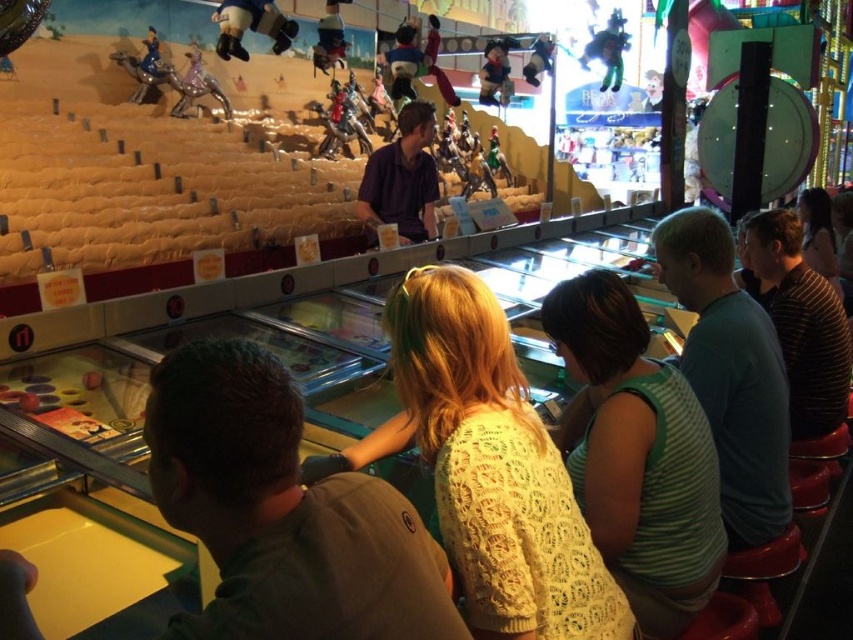
Does green striped tank top at center appear over green striped shirt at right?

Indeed, green striped tank top at center is positioned over green striped shirt at right.

Consider the image. Is green striped tank top at center taller than green striped shirt at right?

In fact, green striped tank top at center may be shorter than green striped shirt at right.

At what (x,y) coordinates should I click in order to perform the action: click on green striped tank top at center. Please return your answer as a coordinate pair (x, y). The height and width of the screenshot is (640, 853). Looking at the image, I should click on pyautogui.click(x=637, y=454).

The height and width of the screenshot is (640, 853). I want to click on green striped tank top at center, so click(x=637, y=454).

Based on the photo, can you confirm if light brown sweater at center is smaller than green striped shirt at right?

Correct, light brown sweater at center occupies less space than green striped shirt at right.

Who is shorter, light brown sweater at center or green striped shirt at right?

With less height is light brown sweater at center.

This screenshot has height=640, width=853. I want to click on light brown sweater at center, so click(x=283, y=512).

Who is lower down, knitted yellow sweater at center or green striped shirt at right?

green striped shirt at right is lower down.

Is knitted yellow sweater at center thinner than green striped shirt at right?

Indeed, knitted yellow sweater at center has a lesser width compared to green striped shirt at right.

Between point (467, 611) and point (717, 326), which one is positioned behind?

The point (717, 326) is behind.

What are the coordinates of `knitted yellow sweater at center` in the screenshot? It's located at (495, 468).